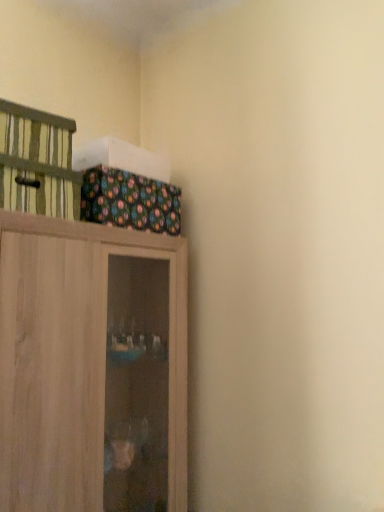
Question: From the image's perspective, relative to green striped cabinet at upper left, is wooden cupboard at upper left above or below?

Choices:
 (A) above
 (B) below

Answer: (B)

Question: In terms of height, does wooden cupboard at upper left look taller or shorter compared to green striped cabinet at upper left?

Choices:
 (A) tall
 (B) short

Answer: (A)

Question: Considering their positions, is wooden cupboard at upper left located in front of or behind green striped cabinet at upper left?

Choices:
 (A) front
 (B) behind

Answer: (A)

Question: Is green striped cabinet at upper left inside or outside of wooden cupboard at upper left?

Choices:
 (A) inside
 (B) outside

Answer: (B)

Question: Is green striped cabinet at upper left wider or thinner than wooden cupboard at upper left?

Choices:
 (A) thin
 (B) wide

Answer: (A)

Question: Is green striped cabinet at upper left to the left or to the right of wooden cupboard at upper left in the image?

Choices:
 (A) right
 (B) left

Answer: (B)

Question: Does point 8,176 appear closer or farther from the camera than point 120,268?

Choices:
 (A) closer
 (B) farther

Answer: (A)